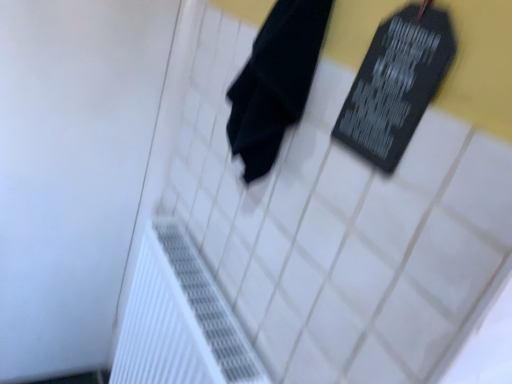
Question: Should I look upward or downward to see black matte board at upper right?

Choices:
 (A) up
 (B) down

Answer: (A)

Question: Considering the relative sizes of black matte towel at center and black matte board at upper right in the image provided, is black matte towel at center shorter than black matte board at upper right?

Choices:
 (A) no
 (B) yes

Answer: (B)

Question: Can you confirm if black matte towel at center is positioned to the right of black matte board at upper right?

Choices:
 (A) no
 (B) yes

Answer: (A)

Question: Does black matte towel at center come behind black matte board at upper right?

Choices:
 (A) yes
 (B) no

Answer: (A)

Question: Does black matte towel at center appear on the left side of black matte board at upper right?

Choices:
 (A) no
 (B) yes

Answer: (B)

Question: Is black matte towel at center wider than black matte board at upper right?

Choices:
 (A) no
 (B) yes

Answer: (B)

Question: Is black matte towel at center bigger than black matte board at upper right?

Choices:
 (A) yes
 (B) no

Answer: (A)

Question: Can you confirm if white textured radiator at lower left is positioned to the left of black matte board at upper right?

Choices:
 (A) yes
 (B) no

Answer: (A)

Question: Is black matte board at upper right at the back of white textured radiator at lower left?

Choices:
 (A) yes
 (B) no

Answer: (B)

Question: Would you say white textured radiator at lower left contains black matte board at upper right?

Choices:
 (A) yes
 (B) no

Answer: (B)

Question: Considering the relative positions of white textured radiator at lower left and black matte board at upper right in the image provided, is white textured radiator at lower left to the right of black matte board at upper right from the viewer's perspective?

Choices:
 (A) yes
 (B) no

Answer: (B)

Question: Is white textured radiator at lower left smaller than black matte board at upper right?

Choices:
 (A) yes
 (B) no

Answer: (B)

Question: Can you confirm if white textured radiator at lower left is wider than black matte board at upper right?

Choices:
 (A) yes
 (B) no

Answer: (A)

Question: From the image's perspective, would you say black matte board at upper right is positioned over white textured radiator at lower left?

Choices:
 (A) yes
 (B) no

Answer: (A)